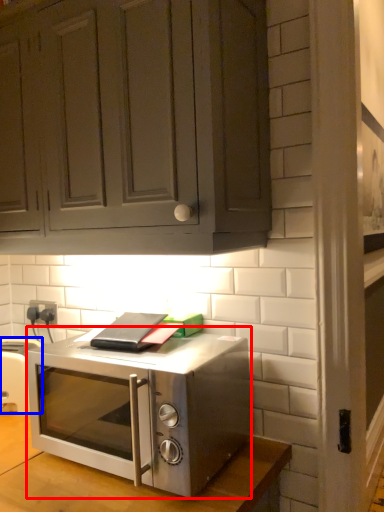
Question: Which object appears farthest to the camera in this image, microwave oven (highlighted by a red box) or appliance (highlighted by a blue box)?

Choices:
 (A) microwave oven
 (B) appliance

Answer: (B)